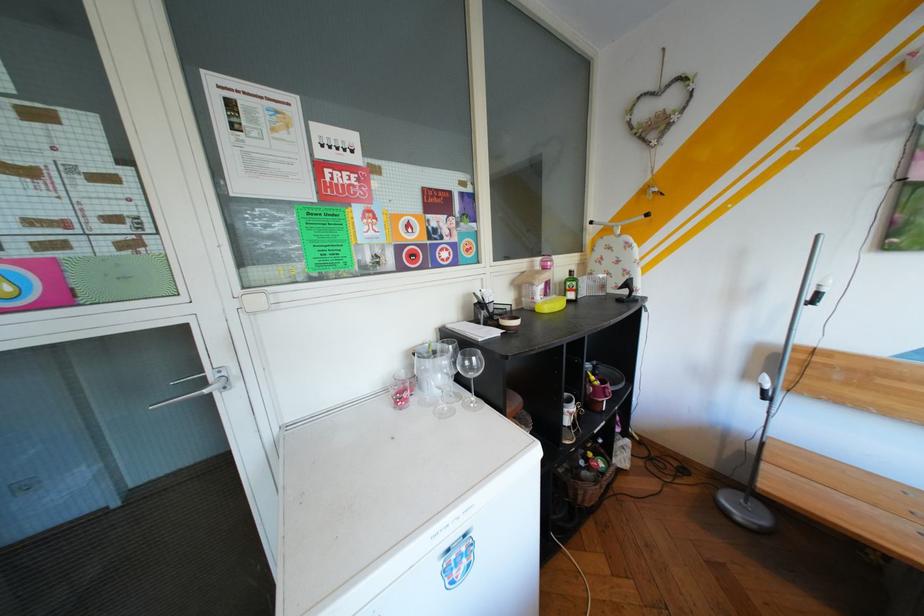
Where would you lift the red mug handle? Please return your answer as a coordinate pair (x, y).

(596, 392)